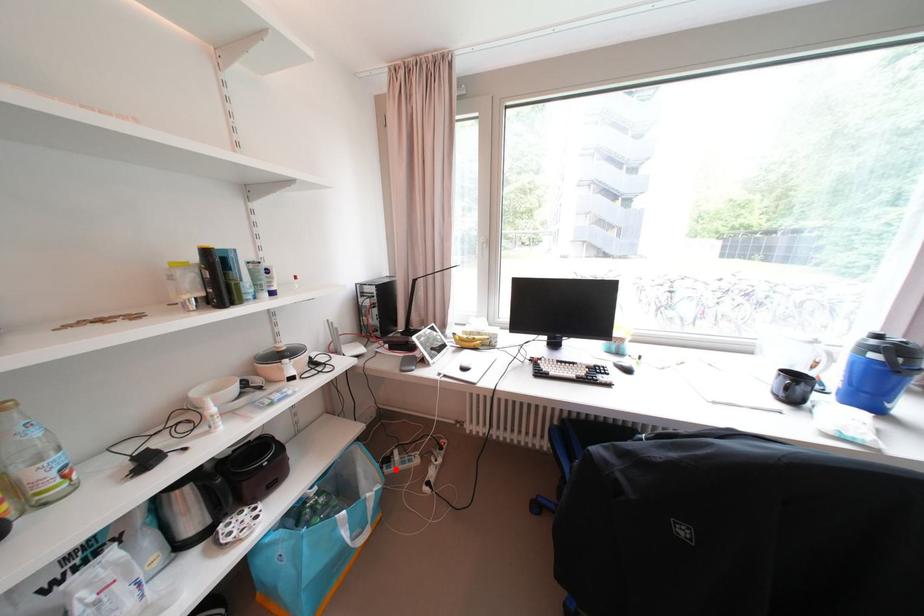
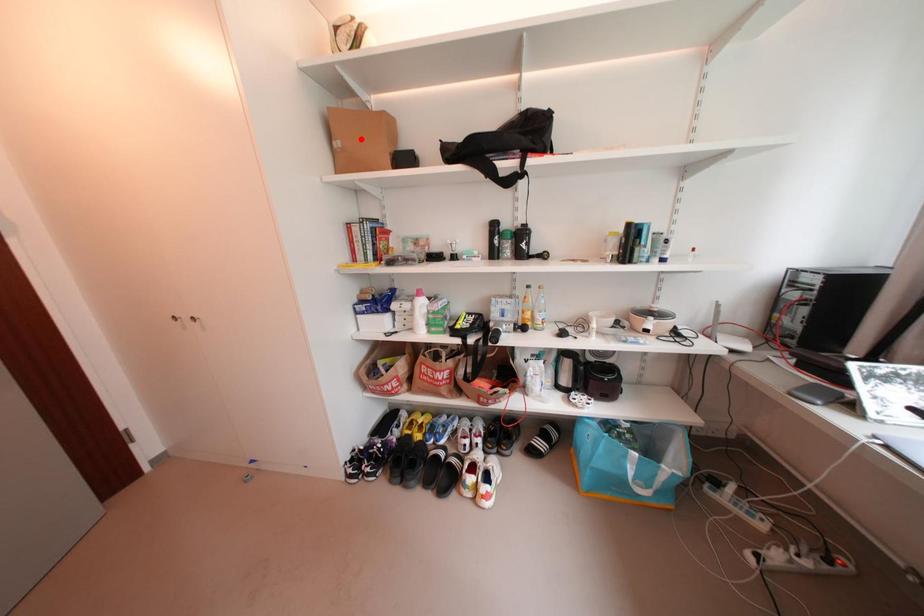
I am providing you with two images of the same scene from different viewpoints. A red point is marked on the first image and another point is marked on the second image. Is the red point in image1 aligned with the point shown in image2?

No